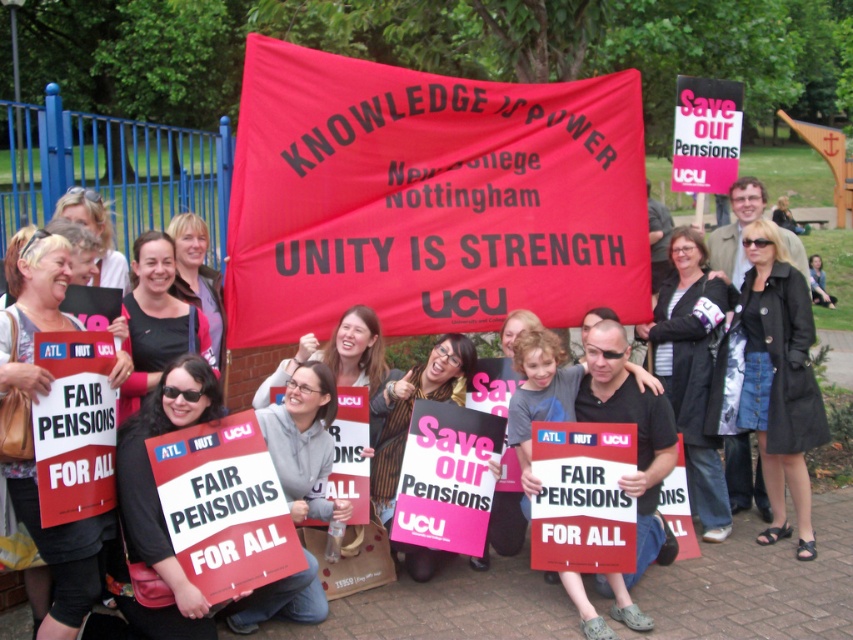
In the scene shown: Where is the red fabric banner at center located in the image?

The red fabric banner at center is located at point [428,196].

You are a photographer trying to capture the protest scene. You notice the red fabric banner at center and the matte black jacket at center. Which object should you focus on first if you want to highlight the main message of the protest?

The red fabric banner at center is located above the matte black jacket at center, so focusing on the red fabric banner at center first will highlight the main message of the protest as it is positioned higher and central in the scene.